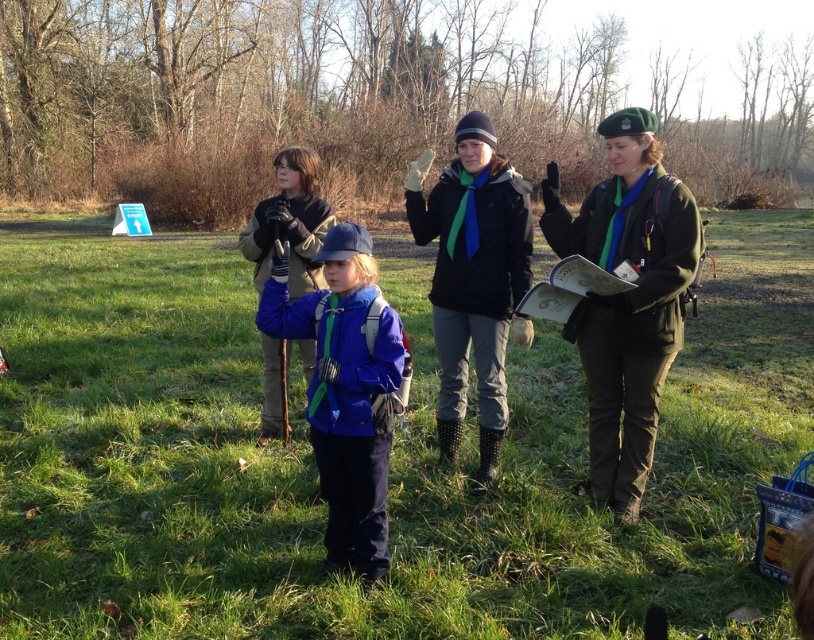
Does green grass at center appear on the right side of matte blue jacket at center?

Incorrect, green grass at center is not on the right side of matte blue jacket at center.

Is point (90, 426) farther from viewer compared to point (283, 316)?

Yes, it is.

Which is in front, point (99, 602) or point (313, 410)?

Point (99, 602) is more forward.

The width and height of the screenshot is (814, 640). I want to click on green grass at center, so click(390, 460).

Does green grass at center have a lesser width compared to green fabric beret at right?

No.

Who is lower down, green grass at center or green fabric beret at right?

green grass at center

Locate an element on the screen. The width and height of the screenshot is (814, 640). green grass at center is located at coordinates tap(390, 460).

This screenshot has width=814, height=640. Find the location of `green fabric beret at right`. green fabric beret at right is located at coordinates (627, 298).

Who is positioned more to the left, green fabric beret at right or matte blue jacket at center?

From the viewer's perspective, matte blue jacket at center appears more on the left side.

You are a GUI agent. You are given a task and a screenshot of the screen. Output one action in this format:
    pyautogui.click(x=<x>, y=<y>)
    Task: Click on the green fabric beret at right
    The image size is (814, 640).
    Given the screenshot: What is the action you would take?
    click(x=627, y=298)